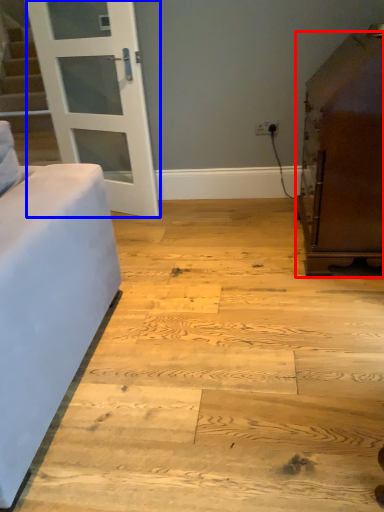
Question: Which object appears closest to the camera in this image, furniture (highlighted by a red box) or door (highlighted by a blue box)?

Choices:
 (A) furniture
 (B) door

Answer: (A)